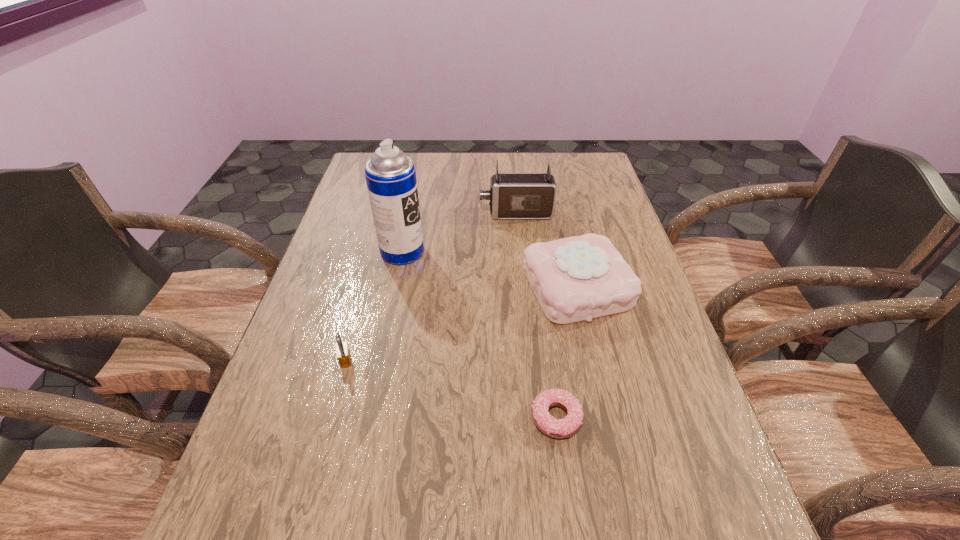
The width and height of the screenshot is (960, 540). I want to click on vacant region at the right edge of the desktop, so [630, 262].

Where is `free point between the cake and the padlock`? The width and height of the screenshot is (960, 540). free point between the cake and the padlock is located at coordinates (461, 323).

Find the location of a particular element. This screenshot has height=540, width=960. blank region between the aerosol can and the shortest object is located at coordinates (479, 335).

The image size is (960, 540). I want to click on free area in between the second shortest object and the second object from left to right, so click(x=373, y=306).

The height and width of the screenshot is (540, 960). Identify the location of empty space that is in between the tallest object and the leftmost object. (x=373, y=306).

Find the location of `free space that is in between the second shortest object and the second tallest object`. free space that is in between the second shortest object and the second tallest object is located at coordinates (431, 287).

At what (x,y) coordinates should I click in order to perform the action: click on empty space between the shortest object and the second tallest object. Please return your answer as a coordinate pair (x, y). This screenshot has height=540, width=960. Looking at the image, I should click on (536, 315).

At what (x,y) coordinates should I click in order to perform the action: click on vacant region between the cake and the second shortest object. Please return your answer as a coordinate pair (x, y). Image resolution: width=960 pixels, height=540 pixels. Looking at the image, I should click on (461, 323).

Locate an element on the screen. free space between the second shortest object and the tallest object is located at coordinates (373, 306).

Identify which object is the fourth nearest to the nearest object. Please provide its 2D coordinates. Your answer should be formatted as a tuple, i.e. [(x, y)], where the tuple contains the x and y coordinates of a point satisfying the conditions above.

[(512, 195)]